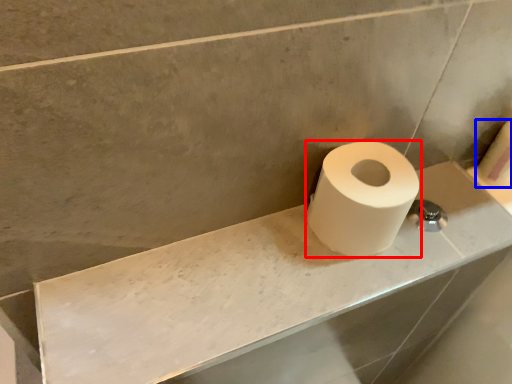
Question: Which object is closer to the camera taking this photo, toilet paper (highlighted by a red box) or toilet paper (highlighted by a blue box)?

Choices:
 (A) toilet paper
 (B) toilet paper

Answer: (A)